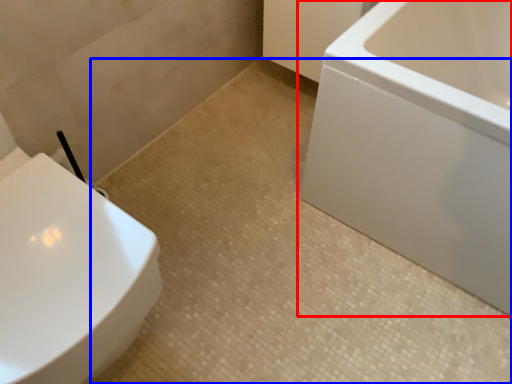
Question: Which object is closer to the camera taking this photo, bathtub (highlighted by a red box) or ceramic tile (highlighted by a blue box)?

Choices:
 (A) bathtub
 (B) ceramic tile

Answer: (A)